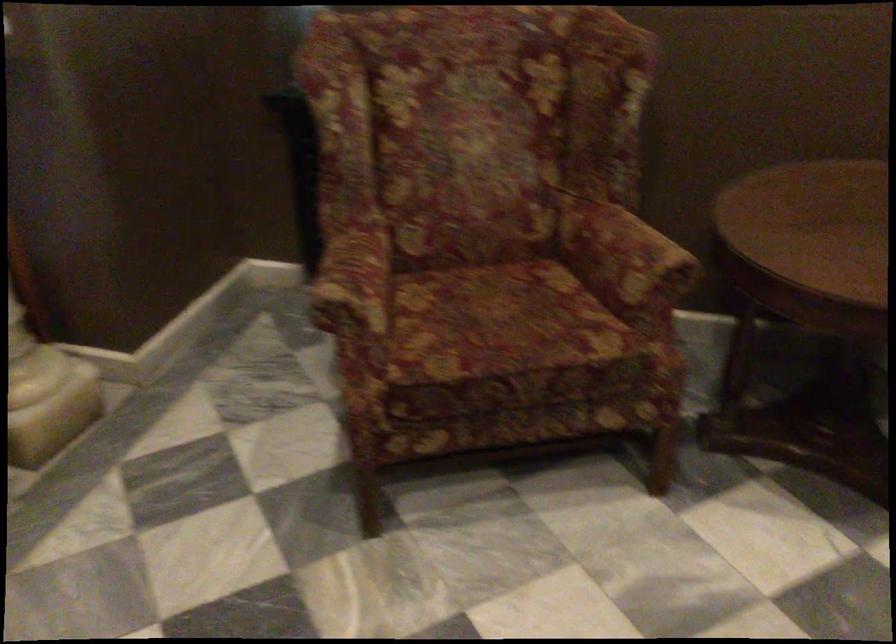
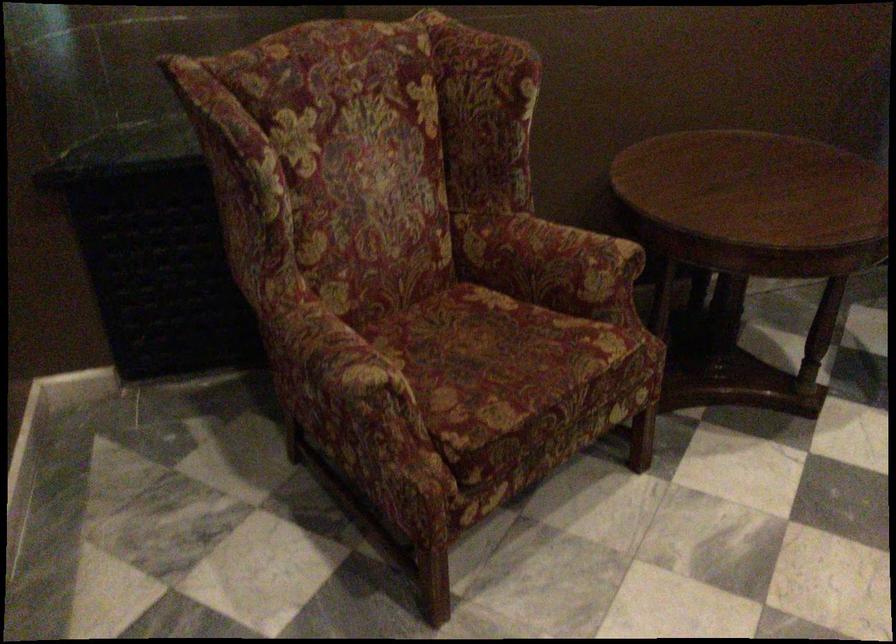
Locate, in the second image, the point that corresponds to point (489, 327) in the first image.

(495, 363)